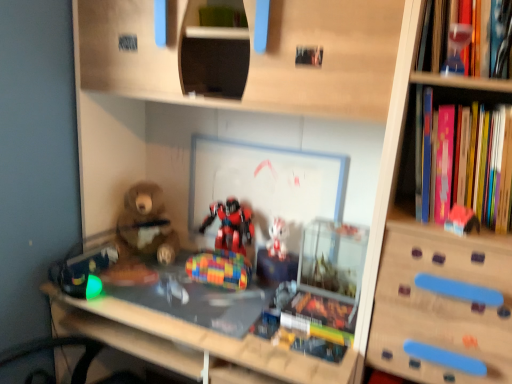
The height and width of the screenshot is (384, 512). Find the location of `free spot in front of multicolored plastic cube at center, the fifth toy when ordered from right to left`. free spot in front of multicolored plastic cube at center, the fifth toy when ordered from right to left is located at coordinates (214, 304).